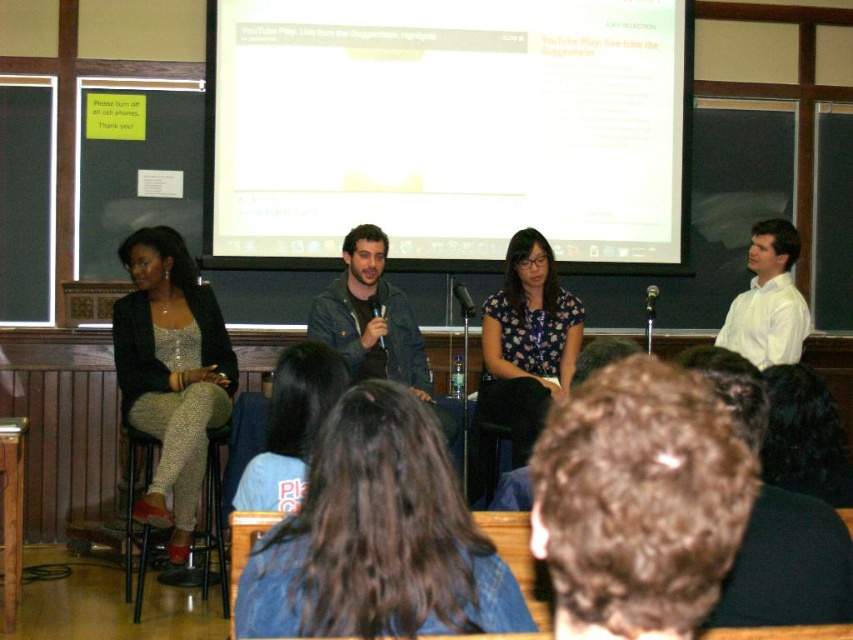
Question: Which is nearer to the floral print blouse at center?

Choices:
 (A) white matte projection screen at upper center
 (B) dark brown hair at upper center

Answer: (A)

Question: Which point is closer to the camera?

Choices:
 (A) dark brown hair at center
 (B) floral print blouse at center
 (C) white matte projection screen at upper center
 (D) denim jacket at center

Answer: (A)

Question: Which point is farther to the camera?

Choices:
 (A) dark brown hair at center
 (B) white matte projection screen at upper center

Answer: (B)

Question: Does sparkly silver pants at left come behind white smooth shirt at upper right?

Choices:
 (A) no
 (B) yes

Answer: (A)

Question: Is white matte projection screen at upper center smaller than white smooth shirt at upper right?

Choices:
 (A) no
 (B) yes

Answer: (A)

Question: From the image, what is the correct spatial relationship of dark brown hair at upper center in relation to floral print blouse at center?

Choices:
 (A) above
 (B) below

Answer: (A)